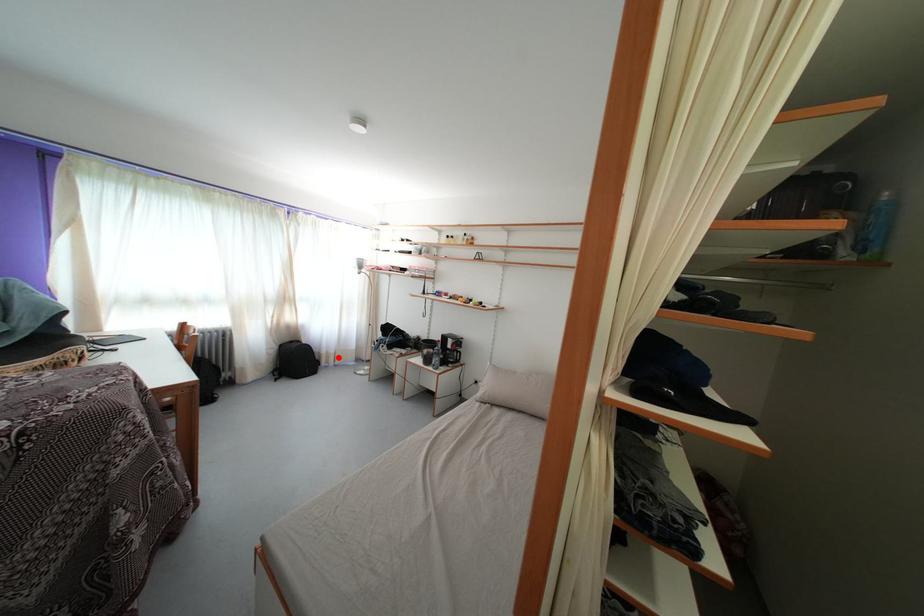
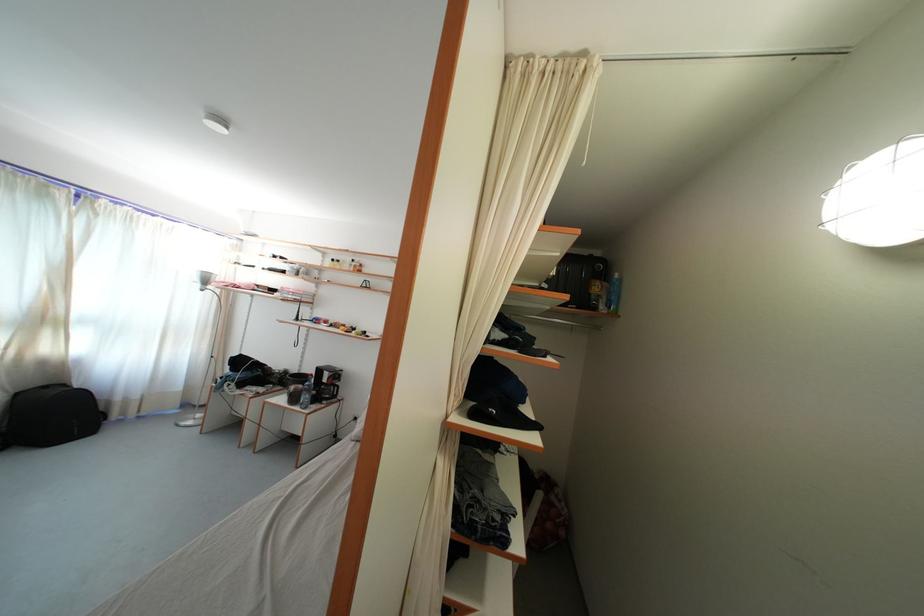
Question: I am providing you with two images of the same scene from different viewpoints. A red point is shown in image1. For the corresponding object point in image2, is it positioned nearer or farther from the camera?

Choices:
 (A) Nearer
 (B) Farther

Answer: (A)